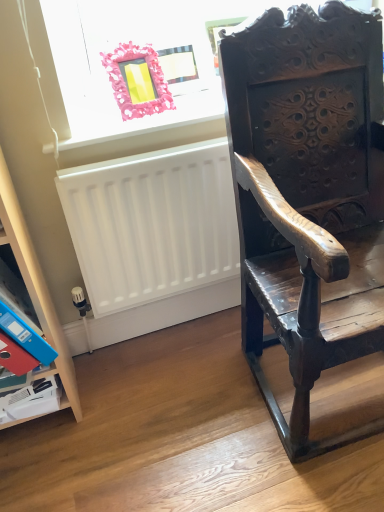
Question: Considering the positions of dark wood carved chair at right and pink fabric picture frame at upper left in the image, is dark wood carved chair at right wider or thinner than pink fabric picture frame at upper left?

Choices:
 (A) thin
 (B) wide

Answer: (B)

Question: From the image's perspective, is dark wood carved chair at right positioned above or below pink fabric picture frame at upper left?

Choices:
 (A) above
 (B) below

Answer: (B)

Question: Based on their relative distances, which object is nearer to the pink fabric picture frame at upper left?

Choices:
 (A) white matte radiator at lower left
 (B) dark wood carved chair at right
 (C) wooden shelf at lower left
 (D) red paper at lower left
 (E) pink plastic frame at upper left

Answer: (E)

Question: Which object is positioned closest to the white matte radiator at lower left?

Choices:
 (A) pink plastic frame at upper left
 (B) red paper at lower left
 (C) pink fabric picture frame at upper left
 (D) dark wood carved chair at right
 (E) wooden shelf at lower left

Answer: (A)